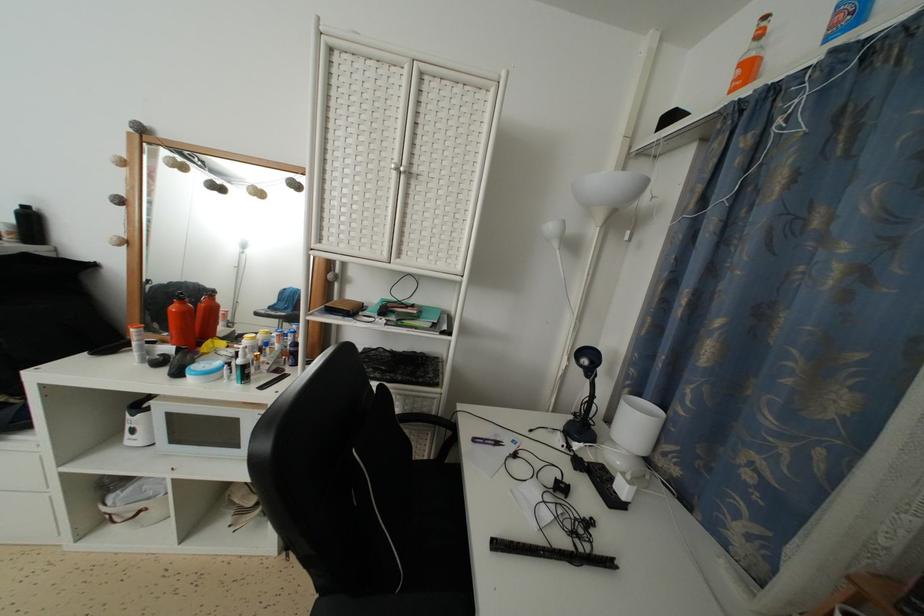
Where is `orange glass bottle`? The height and width of the screenshot is (616, 924). orange glass bottle is located at coordinates (750, 57).